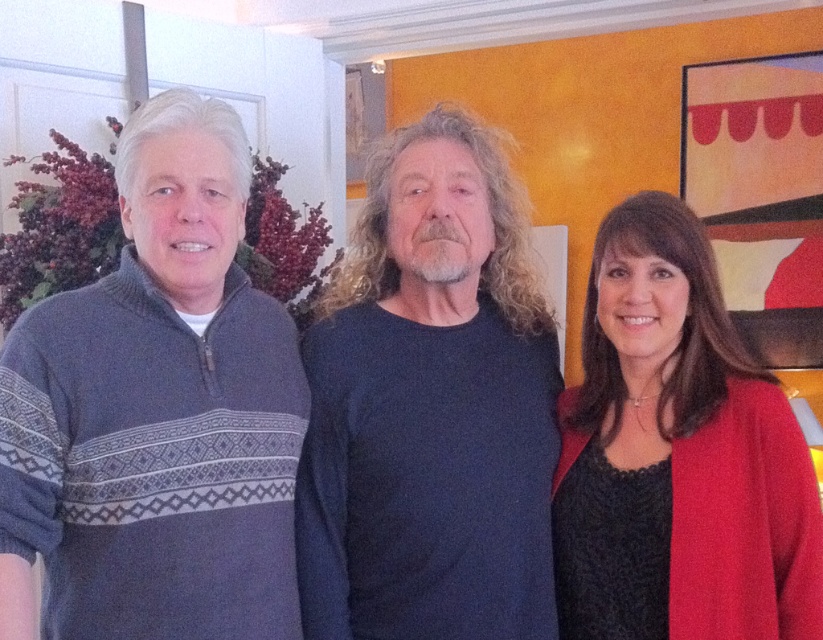
Question: Which of the following is the farthest from the observer?

Choices:
 (A) matte red sweater at right
 (B) dark blue sweater at center
 (C) knit sweater at left

Answer: (B)

Question: Is knit sweater at left further to the viewer compared to matte red sweater at right?

Choices:
 (A) no
 (B) yes

Answer: (A)

Question: Which point appears closest to the camera in this image?

Choices:
 (A) (286, 630)
 (B) (645, 326)

Answer: (A)

Question: Which of the following is the farthest from the observer?

Choices:
 (A) knit sweater at left
 (B) matte red sweater at right

Answer: (B)

Question: Can you confirm if knit sweater at left is positioned above matte red sweater at right?

Choices:
 (A) yes
 (B) no

Answer: (A)

Question: Does knit sweater at left have a greater width compared to dark blue sweater at center?

Choices:
 (A) no
 (B) yes

Answer: (A)